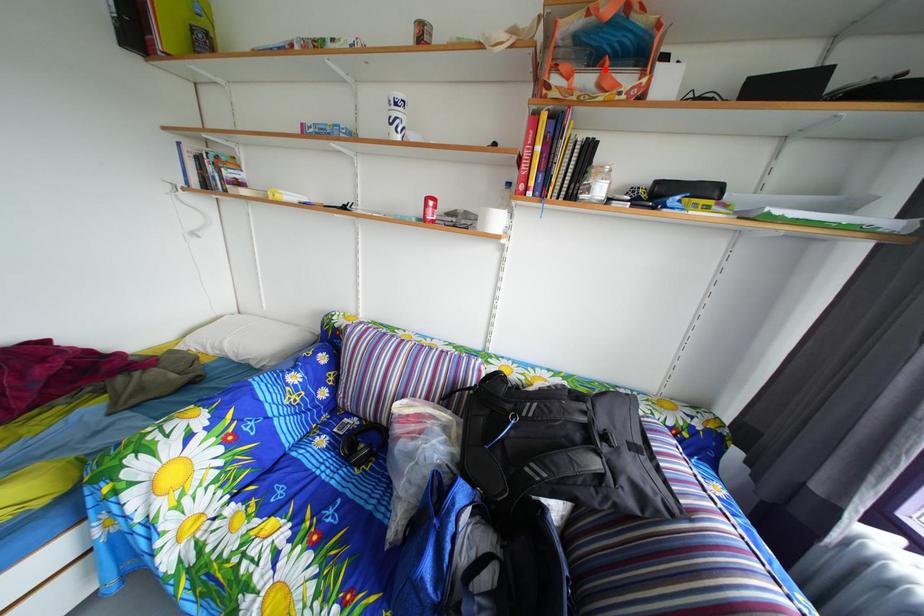
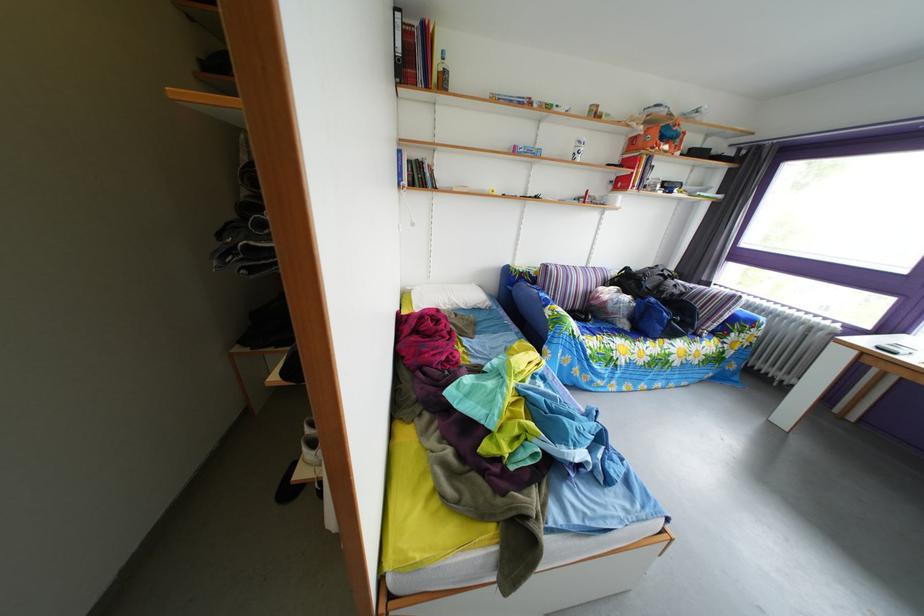
The point at the highlighted location is marked in the first image. Where is the corresponding point in the second image?

(673, 147)